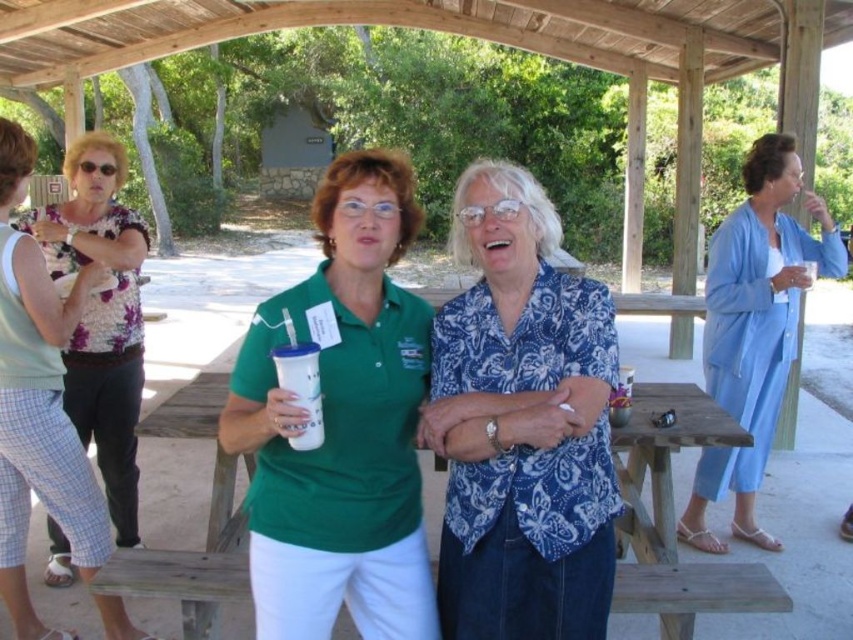
You are organizing a photo shoot and need to arrange two shirts for a photoshoot setup. The blue paisley shirt at center and the green matte shirt at center are placed on a mannequin. Which shirt should you place on the left side if you want the narrower one to be on the left?

The blue paisley shirt at center has a lesser width compared to the green matte shirt at center, so you should place the blue paisley shirt at center on the left side to have the narrower one there.